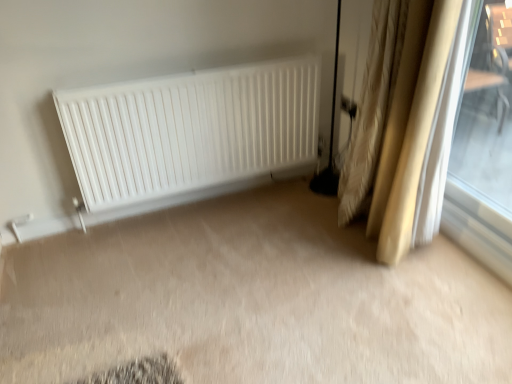
Question: Is transparent glass window at right looking in the opposite direction of beige textured curtains at right?

Choices:
 (A) no
 (B) yes

Answer: (A)

Question: Is transparent glass window at right oriented towards beige textured curtains at right?

Choices:
 (A) yes
 (B) no

Answer: (B)

Question: Considering the relative sizes of transparent glass window at right and beige textured curtains at right in the image provided, is transparent glass window at right wider than beige textured curtains at right?

Choices:
 (A) yes
 (B) no

Answer: (B)

Question: Is transparent glass window at right directly adjacent to beige textured curtains at right?

Choices:
 (A) yes
 (B) no

Answer: (B)

Question: Is transparent glass window at right thinner than beige textured curtains at right?

Choices:
 (A) no
 (B) yes

Answer: (B)

Question: Does transparent glass window at right have a larger size compared to beige textured curtains at right?

Choices:
 (A) yes
 (B) no

Answer: (B)

Question: Is beige textured curtains at right surrounded by white matte radiator at center?

Choices:
 (A) no
 (B) yes

Answer: (A)

Question: Does white matte radiator at center appear on the left side of beige textured curtains at right?

Choices:
 (A) no
 (B) yes

Answer: (B)

Question: Is the position of white matte radiator at center less distant than that of beige textured curtains at right?

Choices:
 (A) no
 (B) yes

Answer: (A)

Question: Is beige textured curtains at right at the back of white matte radiator at center?

Choices:
 (A) no
 (B) yes

Answer: (A)

Question: Is white matte radiator at center facing towards beige textured curtains at right?

Choices:
 (A) no
 (B) yes

Answer: (B)

Question: From the image's perspective, is white matte radiator at center located above beige textured curtains at right?

Choices:
 (A) yes
 (B) no

Answer: (B)

Question: Would you say beige textured curtains at right is outside white matte radiator at center?

Choices:
 (A) no
 (B) yes

Answer: (B)